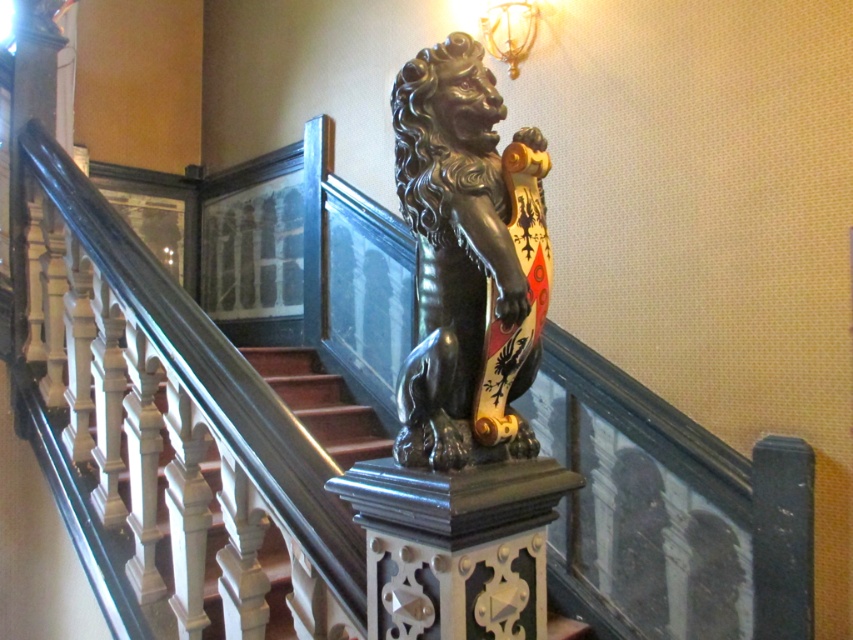
You are an interior designer planning to install a new chandelier in this space. The chandelier you have chosen is 1.5 meters tall. Considering the white glossy stair at left and the metallic gold lamp at upper center, which object would the chandelier be taller than?

The white glossy stair at left has a greater height compared to the metallic gold lamp at upper center. Since the chandelier is 1.5 meters tall, it would be taller than the metallic gold lamp at upper center but not the stair.